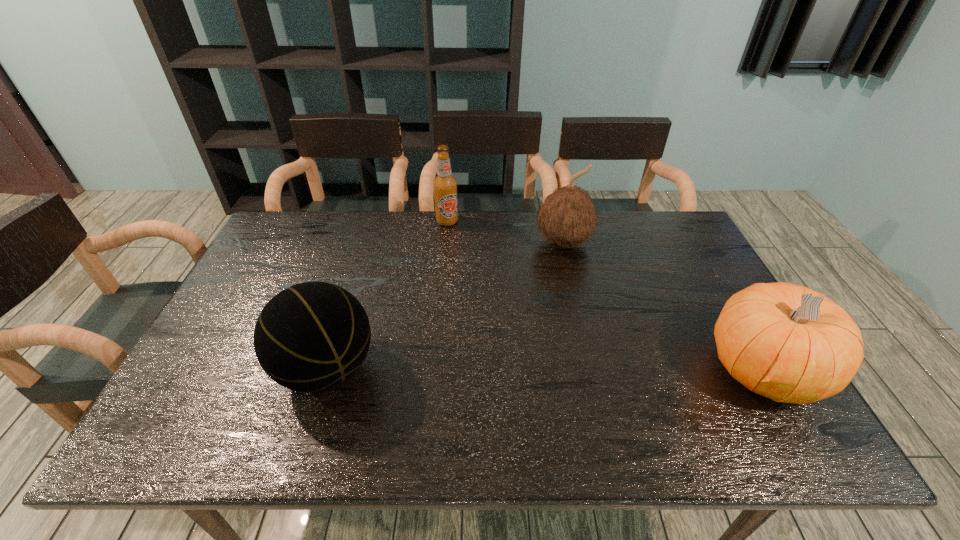
Locate an element on the screen. vacant spot on the desktop that is between the basketball and the pumpkin and is positioned on the surface of the coconut is located at coordinates (606, 370).

In order to click on free space on the desktop that is between the basketball and the pumpkin and is positioned on the front label of the second object from left to right in this screenshot , I will do `click(497, 370)`.